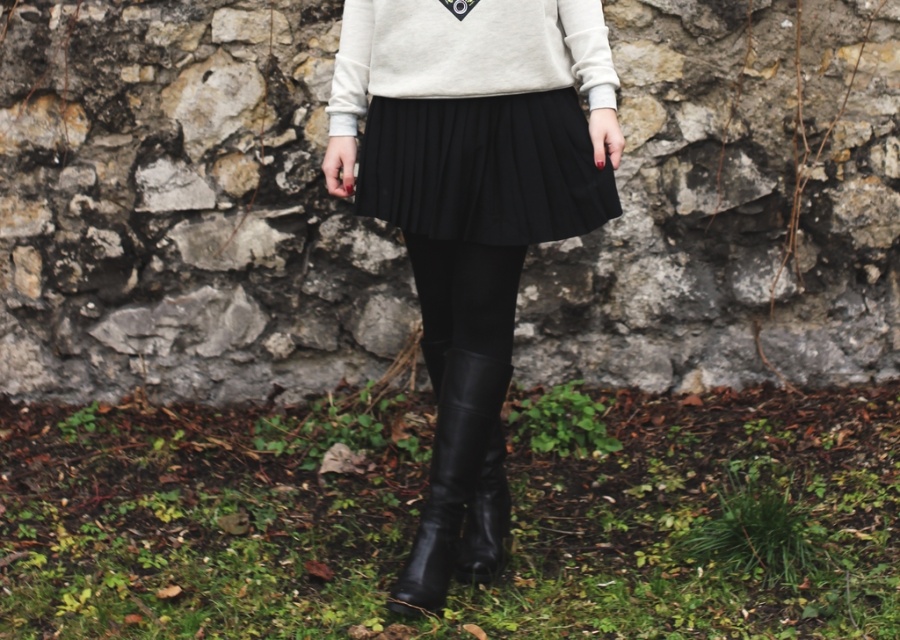
Is suede-like beige sweater at center smaller than black leather leggings at center?

Correct, suede-like beige sweater at center occupies less space than black leather leggings at center.

Does suede-like beige sweater at center have a lesser width compared to black leather leggings at center?

No.

The width and height of the screenshot is (900, 640). What do you see at coordinates (468, 51) in the screenshot?
I see `suede-like beige sweater at center` at bounding box center [468, 51].

Image resolution: width=900 pixels, height=640 pixels. Find the location of `suede-like beige sweater at center`. suede-like beige sweater at center is located at coordinates (468, 51).

Who is positioned more to the right, black leather skirt at center or suede-like beige sweater at center?

From the viewer's perspective, black leather skirt at center appears more on the right side.

Is point (543, 188) farther from viewer compared to point (610, 77)?

Yes, it is behind point (610, 77).

Locate an element on the screen. Image resolution: width=900 pixels, height=640 pixels. black leather skirt at center is located at coordinates (471, 212).

Where is `black leather skirt at center`? black leather skirt at center is located at coordinates (471, 212).

Is black leather skirt at center taller than black leather leggings at center?

Yes, black leather skirt at center is taller than black leather leggings at center.

Which of these two, black leather skirt at center or black leather leggings at center, stands taller?

black leather skirt at center is taller.

Where is `black leather skirt at center`? Image resolution: width=900 pixels, height=640 pixels. black leather skirt at center is located at coordinates (471, 212).